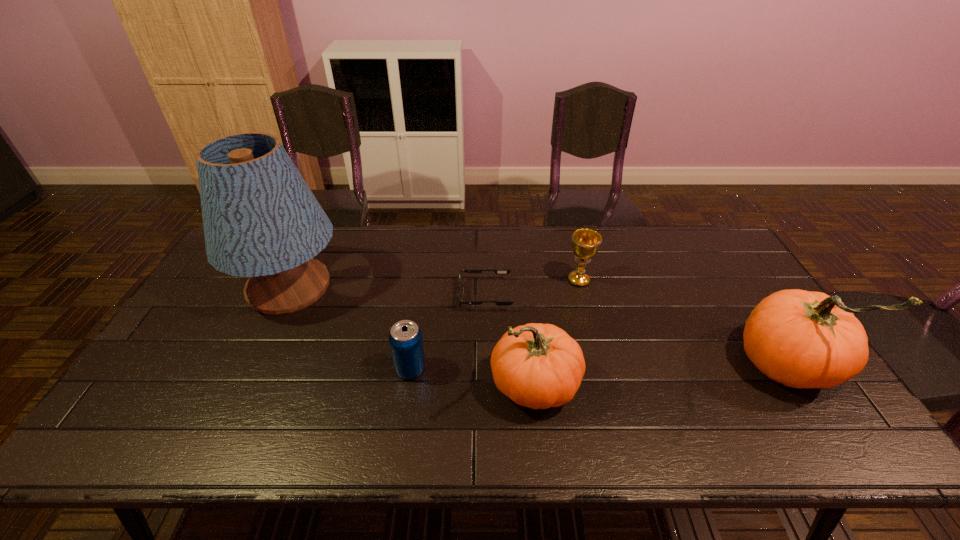
Locate an element on the screen. This screenshot has width=960, height=540. vacant point located on the right of the left pumpkin is located at coordinates (600, 386).

You are a GUI agent. You are given a task and a screenshot of the screen. Output one action in this format:
    pyautogui.click(x=<x>, y=<y>)
    Task: Click on the vacant space located on the left of the second tallest object
    
    Given the screenshot: What is the action you would take?
    pyautogui.click(x=690, y=366)

Locate an element on the screen. This screenshot has height=540, width=960. free space located on the front of the chalice is located at coordinates tap(610, 400).

The image size is (960, 540). I want to click on blank area located 0.130m on the temples of the shortest object, so click(417, 295).

Locate an element on the screen. Image resolution: width=960 pixels, height=540 pixels. blank area located 0.050m on the temples of the shortest object is located at coordinates (443, 295).

I want to click on vacant region located 0.220m on the temples of the shortest object, so click(x=388, y=295).

The height and width of the screenshot is (540, 960). Find the location of `vacant space located 0.100m on the right of the fifth tallest object`. vacant space located 0.100m on the right of the fifth tallest object is located at coordinates (465, 369).

This screenshot has width=960, height=540. What are the coordinates of `free spot located on the right of the leftmost object` in the screenshot? It's located at (452, 287).

Find the location of a particular element. This screenshot has height=540, width=960. object present at the far edge is located at coordinates (261, 220).

Identify the location of object that is at the left edge. (261, 220).